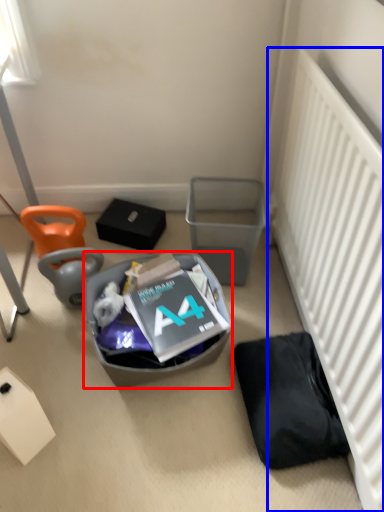
Question: Among these objects, which one is nearest to the camera, trash bin/can (highlighted by a red box) or radiator (highlighted by a blue box)?

Choices:
 (A) trash bin/can
 (B) radiator

Answer: (B)